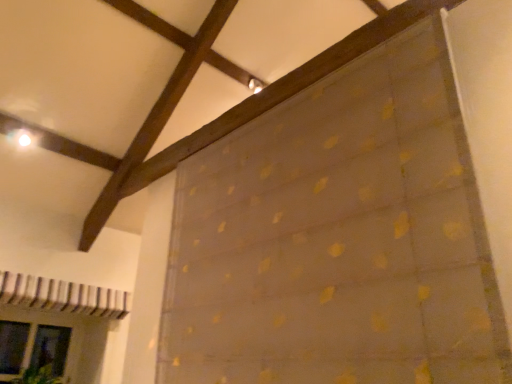
This screenshot has width=512, height=384. Describe the element at coordinates (50, 348) in the screenshot. I see `transparent glass door at lower left` at that location.

You are a GUI agent. You are given a task and a screenshot of the screen. Output one action in this format:
    pyautogui.click(x=<x>, y=<y>)
    Task: Click on the transparent glass door at lower left
    
    Given the screenshot: What is the action you would take?
    pyautogui.click(x=50, y=348)

This screenshot has width=512, height=384. What do you see at coordinates (338, 238) in the screenshot?
I see `translucent yellow dots at center` at bounding box center [338, 238].

Locate an element on the screen. translucent yellow dots at center is located at coordinates (338, 238).

Where is `transparent glass door at lower left`? transparent glass door at lower left is located at coordinates (50, 348).

Looking at this image, can you confirm if translucent yellow dots at center is positioned to the right of transparent glass door at lower left?

Indeed, translucent yellow dots at center is positioned on the right side of transparent glass door at lower left.

Is translucent yellow dots at center in front of or behind transparent glass door at lower left in the image?

translucent yellow dots at center is positioned closer to the viewer than transparent glass door at lower left.

Is point (330, 278) positioned before point (6, 344)?

Yes, it is.

From the image's perspective, is translucent yellow dots at center positioned above or below transparent glass door at lower left?

Clearly, from the image's perspective, translucent yellow dots at center is above transparent glass door at lower left.

From a real-world perspective, does translucent yellow dots at center sit lower than transparent glass door at lower left?

No, from a real-world perspective, translucent yellow dots at center is not under transparent glass door at lower left.

Can you confirm if translucent yellow dots at center is wider than transparent glass door at lower left?

No, translucent yellow dots at center is not wider than transparent glass door at lower left.

Does translucent yellow dots at center have a greater height compared to transparent glass door at lower left?

Correct, translucent yellow dots at center is much taller as transparent glass door at lower left.

Considering the relative sizes of translucent yellow dots at center and transparent glass door at lower left in the image provided, is translucent yellow dots at center smaller than transparent glass door at lower left?

No.

Is translucent yellow dots at center completely or partially outside of transparent glass door at lower left?

A: Yes, translucent yellow dots at center is outside of transparent glass door at lower left.

Is translucent yellow dots at center with transparent glass door at lower left?

No, translucent yellow dots at center is not in contact with transparent glass door at lower left.

Is translucent yellow dots at center aimed at transparent glass door at lower left?

No, translucent yellow dots at center is not facing towards transparent glass door at lower left.

How many degrees apart are the facing directions of translucent yellow dots at center and transparent glass door at lower left?

The angle between the facing direction of translucent yellow dots at center and the facing direction of transparent glass door at lower left is 89 degrees.

Find the location of a particular element. curtain on the right side of transparent glass door at lower left is located at coordinates (338, 238).

Can you confirm if transparent glass door at lower left is positioned to the right of translucent yellow dots at center?

In fact, transparent glass door at lower left is to the left of translucent yellow dots at center.

Which object is further away from the camera taking this photo, transparent glass door at lower left or translucent yellow dots at center?

transparent glass door at lower left is further away from the camera.

Which is behind, point (2, 347) or point (409, 51)?

Positioned behind is point (2, 347).

Looking at this image, from the image's perspective, is transparent glass door at lower left above translucent yellow dots at center?

No, from the image's perspective, transparent glass door at lower left is not above translucent yellow dots at center.

From a real-world perspective, which object rests below the other?

transparent glass door at lower left, from a real-world perspective.

Considering the sizes of objects transparent glass door at lower left and translucent yellow dots at center in the image provided, who is thinner, transparent glass door at lower left or translucent yellow dots at center?

Thinner between the two is translucent yellow dots at center.

Is transparent glass door at lower left taller or shorter than translucent yellow dots at center?

transparent glass door at lower left is shorter than translucent yellow dots at center.

In terms of size, does transparent glass door at lower left appear bigger or smaller than translucent yellow dots at center?

In the image, transparent glass door at lower left appears to be smaller than translucent yellow dots at center.

Would you say translucent yellow dots at center is part of transparent glass door at lower left's contents?

No, transparent glass door at lower left does not contain translucent yellow dots at center.

Is transparent glass door at lower left touching translucent yellow dots at center?

No.

Is transparent glass door at lower left turned away from translucent yellow dots at center?

No.

In the scene shown: How far apart are transparent glass door at lower left and translucent yellow dots at center?

A distance of 2.69 meters exists between transparent glass door at lower left and translucent yellow dots at center.

Image resolution: width=512 pixels, height=384 pixels. What are the coordinates of `glass door below the translucent yellow dots at center (from the image's perspective)` in the screenshot? It's located at (50, 348).

Image resolution: width=512 pixels, height=384 pixels. Find the location of `curtain that is in front of the transparent glass door at lower left`. curtain that is in front of the transparent glass door at lower left is located at coordinates (338, 238).

Identify the location of glass door that is below the translucent yellow dots at center (from the image's perspective). The width and height of the screenshot is (512, 384). 50,348.